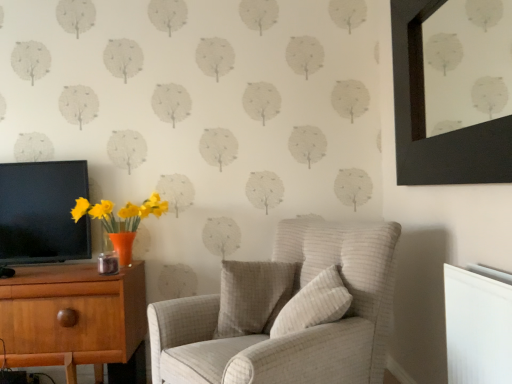
What do you see at coordinates (314, 304) in the screenshot? I see `beige textured pillow at center, acting as the 2th pillow starting from the back` at bounding box center [314, 304].

In order to face black glossy tv at left, should I rotate leftwards or rightwards?

You should look left and rotate roughly 26.167 degrees.

Describe the element at coordinates (477, 327) in the screenshot. The image size is (512, 384). I see `white plastic radiator at lower right` at that location.

Find the location of a particular element. Image resolution: width=512 pixels, height=384 pixels. light beige fabric armchair at center is located at coordinates (285, 311).

Are black matte picture frame at upper right and white plastic radiator at lower right making contact?

They are not placed beside each other.

Considering the positions of objects black matte picture frame at upper right and white plastic radiator at lower right in the image provided, who is more to the right, black matte picture frame at upper right or white plastic radiator at lower right?

From the viewer's perspective, white plastic radiator at lower right appears more on the right side.

From the image's perspective, is black matte picture frame at upper right on white plastic radiator at lower right?

Indeed, from the image's perspective, black matte picture frame at upper right is shown above white plastic radiator at lower right.

Is point (421, 10) closer or farther from the camera than point (458, 339)?

Point (421, 10) is positioned farther from the camera compared to point (458, 339).

There is a black glossy tv at left. Find the location of `the 2nd pillow below it (from the image's perspective)`. the 2nd pillow below it (from the image's perspective) is located at coordinates (252, 296).

Consider the image. From the image's perspective, which one is positioned higher, textured white pillow at center, which is counted as the first pillow, starting from the back, or black glossy tv at left?

black glossy tv at left is shown above in the image.

What's the angular difference between textured white pillow at center, the 2th pillow positioned from the front, and black glossy tv at left's facing directions?

The angular difference between textured white pillow at center, the 2th pillow positioned from the front, and black glossy tv at left is 12.9 degrees.

Who is taller, textured white pillow at center, which is counted as the first pillow, starting from the back, or black glossy tv at left?

black glossy tv at left is taller.

Based on the photo, considering the relative sizes of beige textured pillow at center, marked as the first pillow in a front-to-back arrangement, and white plastic radiator at lower right in the image provided, is beige textured pillow at center, marked as the first pillow in a front-to-back arrangement, wider than white plastic radiator at lower right?

Correct, the width of beige textured pillow at center, marked as the first pillow in a front-to-back arrangement, exceeds that of white plastic radiator at lower right.

Image resolution: width=512 pixels, height=384 pixels. In order to click on the 2nd pillow located above the white plastic radiator at lower right (from a real-world perspective) in this screenshot , I will do `click(314, 304)`.

From a real-world perspective, is beige textured pillow at center, acting as the 2th pillow starting from the back, over white plastic radiator at lower right?

Yes, from a real-world perspective, beige textured pillow at center, acting as the 2th pillow starting from the back, is above white plastic radiator at lower right.

Identify the location of desk on the left of beige textured pillow at center, marked as the first pillow in a front-to-back arrangement. This screenshot has width=512, height=384. (77, 319).

Is beige textured pillow at center, acting as the 2th pillow starting from the back, not close to wooden desk at left?

beige textured pillow at center, acting as the 2th pillow starting from the back, is actually quite close to wooden desk at left.

Based on the photo, could you measure the distance between beige textured pillow at center, marked as the first pillow in a front-to-back arrangement, and wooden desk at left?

A distance of 38.71 inches exists between beige textured pillow at center, marked as the first pillow in a front-to-back arrangement, and wooden desk at left.

Based on their sizes in the image, would you say beige textured pillow at center, acting as the 2th pillow starting from the back, is bigger or smaller than wooden desk at left?

In the image, beige textured pillow at center, acting as the 2th pillow starting from the back, appears to be smaller than wooden desk at left.

Considering the relative sizes of black matte picture frame at upper right and black glossy tv at left in the image provided, is black matte picture frame at upper right shorter than black glossy tv at left?

→ In fact, black matte picture frame at upper right may be taller than black glossy tv at left.

From the image's perspective, which one is positioned lower, black matte picture frame at upper right or black glossy tv at left?

black glossy tv at left, from the image's perspective.

Is black matte picture frame at upper right inside or outside of black glossy tv at left?

black matte picture frame at upper right cannot be found inside black glossy tv at left.

Between black matte picture frame at upper right and black glossy tv at left, which one appears on the right side from the viewer's perspective?

black matte picture frame at upper right is more to the right.

Does point (214, 378) lie behind point (456, 304)?

That is True.

Based on their positions, is light beige fabric armchair at center located to the left or right of white plastic radiator at lower right?

Based on their positions, light beige fabric armchair at center is located to the left of white plastic radiator at lower right.

Where is `radiator above the light beige fabric armchair at center (from the image's perspective)`? Image resolution: width=512 pixels, height=384 pixels. radiator above the light beige fabric armchair at center (from the image's perspective) is located at coordinates (477, 327).

Which is correct: light beige fabric armchair at center is inside white plastic radiator at lower right, or outside of it?

The correct answer is: outside.

Considering the relative positions of white plastic radiator at lower right and wooden desk at left in the image provided, is white plastic radiator at lower right to the left or to the right of wooden desk at left?

white plastic radiator at lower right is to the right of wooden desk at left.

Considering the sizes of objects white plastic radiator at lower right and wooden desk at left in the image provided, who is bigger, white plastic radiator at lower right or wooden desk at left?

Bigger between the two is wooden desk at left.

In the scene shown: Which point is more forward, [466,321] or [116,377]?

Positioned in front is point [466,321].

Locate an element on the screen. The image size is (512, 384). picture frame on the left of white plastic radiator at lower right is located at coordinates (424, 118).

Where is `television behind the textured white pillow at center, which is counted as the first pillow, starting from the back`? The height and width of the screenshot is (384, 512). television behind the textured white pillow at center, which is counted as the first pillow, starting from the back is located at coordinates (42, 212).

Considering their positions, is black glossy tv at left positioned further to wooden desk at left than textured white pillow at center, which is counted as the first pillow, starting from the back?

textured white pillow at center, which is counted as the first pillow, starting from the back, is positioned further to the anchor wooden desk at left.

When comparing their distances from black glossy tv at left, does wooden desk at left or beige textured pillow at center, acting as the 2th pillow starting from the back, seem further?

beige textured pillow at center, acting as the 2th pillow starting from the back, is further to black glossy tv at left.

Considering their positions, is wooden desk at left positioned closer to textured white pillow at center, the 2th pillow positioned from the front, than beige textured pillow at center, acting as the 2th pillow starting from the back?

The object closer to textured white pillow at center, the 2th pillow positioned from the front, is beige textured pillow at center, acting as the 2th pillow starting from the back.

Estimate the real-world distances between objects in this image. Which object is further from light beige fabric armchair at center, wooden desk at left or white plastic radiator at lower right?

Among the two, wooden desk at left is located further to light beige fabric armchair at center.

Consider the image. Based on their spatial positions, is light beige fabric armchair at center or beige textured pillow at center, acting as the 2th pillow starting from the back, further from white plastic radiator at lower right?

light beige fabric armchair at center is positioned further to the anchor white plastic radiator at lower right.

Based on the photo, which object lies nearer to the anchor point wooden desk at left, beige textured pillow at center, acting as the 2th pillow starting from the back, or white plastic radiator at lower right?

beige textured pillow at center, acting as the 2th pillow starting from the back, lies closer to wooden desk at left than the other object.

When comparing their distances from beige textured pillow at center, marked as the first pillow in a front-to-back arrangement, does light beige fabric armchair at center or textured white pillow at center, which is counted as the first pillow, starting from the back, seem closer?

light beige fabric armchair at center is positioned closer to the anchor beige textured pillow at center, marked as the first pillow in a front-to-back arrangement.

Estimate the real-world distances between objects in this image. Which object is closer to black matte picture frame at upper right, light beige fabric armchair at center or white plastic radiator at lower right?

white plastic radiator at lower right.

At what (x,y) coordinates should I click in order to perform the action: click on pillow between textured white pillow at center, the 2th pillow positioned from the front, and white plastic radiator at lower right, in the horizontal direction. Please return your answer as a coordinate pair (x, y). This screenshot has height=384, width=512. Looking at the image, I should click on (314, 304).

The width and height of the screenshot is (512, 384). I want to click on pillow between wooden desk at left and beige textured pillow at center, marked as the first pillow in a front-to-back arrangement, from left to right, so click(252, 296).

Identify the location of radiator between black matte picture frame at upper right and light beige fabric armchair at center in the vertical direction. The image size is (512, 384). (477, 327).

Where is `chair situated between textured white pillow at center, the 2th pillow positioned from the front, and white plastic radiator at lower right from left to right`? Image resolution: width=512 pixels, height=384 pixels. chair situated between textured white pillow at center, the 2th pillow positioned from the front, and white plastic radiator at lower right from left to right is located at coordinates (285, 311).